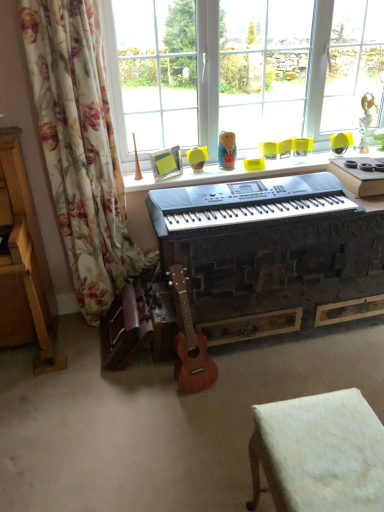
Question: Should I look upward or downward to see transparent glass window at upper center?

Choices:
 (A) up
 (B) down

Answer: (A)

Question: Is matte plastic doll at upper center not inside floral fabric curtain at left?

Choices:
 (A) yes
 (B) no

Answer: (A)

Question: From a real-world perspective, is matte plastic doll at upper center below floral fabric curtain at left?

Choices:
 (A) no
 (B) yes

Answer: (A)

Question: From the image's perspective, is matte plastic doll at upper center on top of floral fabric curtain at left?

Choices:
 (A) yes
 (B) no

Answer: (A)

Question: From a real-world perspective, does matte plastic doll at upper center stand above floral fabric curtain at left?

Choices:
 (A) no
 (B) yes

Answer: (B)

Question: Would you say matte plastic doll at upper center contains floral fabric curtain at left?

Choices:
 (A) yes
 (B) no

Answer: (B)

Question: Does matte plastic doll at upper center have a lesser height compared to floral fabric curtain at left?

Choices:
 (A) no
 (B) yes

Answer: (B)

Question: Considering the relative positions of wooden acoustic guitar at center and black plastic keyboard at center in the image provided, is wooden acoustic guitar at center in front of black plastic keyboard at center?

Choices:
 (A) yes
 (B) no

Answer: (B)

Question: Is wooden acoustic guitar at center behind black plastic keyboard at center?

Choices:
 (A) no
 (B) yes

Answer: (B)

Question: From the image's perspective, does wooden acoustic guitar at center appear higher than black plastic keyboard at center?

Choices:
 (A) yes
 (B) no

Answer: (B)

Question: Is wooden acoustic guitar at center looking in the opposite direction of black plastic keyboard at center?

Choices:
 (A) no
 (B) yes

Answer: (A)

Question: Considering the relative sizes of wooden acoustic guitar at center and black plastic keyboard at center in the image provided, is wooden acoustic guitar at center smaller than black plastic keyboard at center?

Choices:
 (A) no
 (B) yes

Answer: (B)

Question: From a real-world perspective, is wooden acoustic guitar at center positioned under black plastic keyboard at center based on gravity?

Choices:
 (A) yes
 (B) no

Answer: (A)

Question: Is wooden acoustic guitar at center oriented away from black plastic keyboard at center?

Choices:
 (A) yes
 (B) no

Answer: (A)